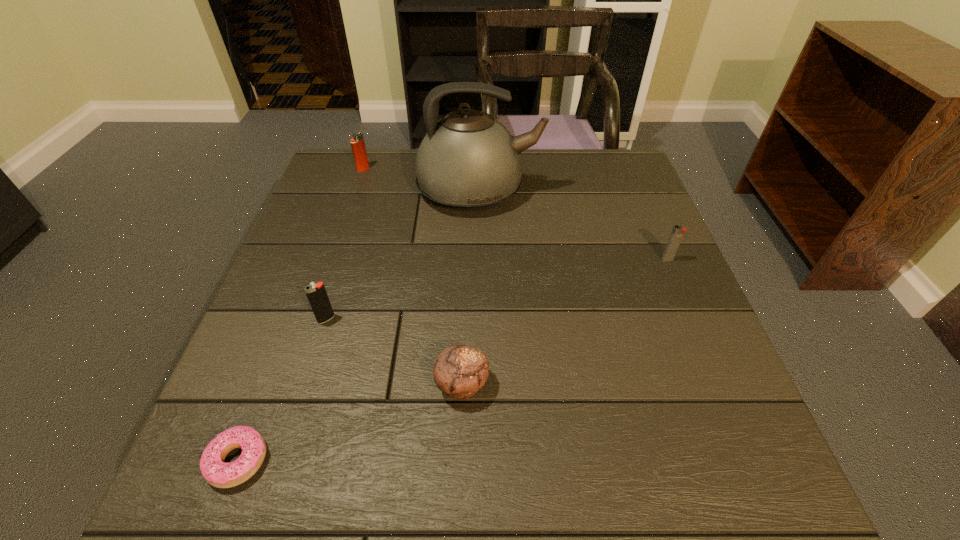
The height and width of the screenshot is (540, 960). I want to click on kettle, so click(x=468, y=161).

At what (x,y) coordinates should I click in order to perform the action: click on the farthest igniter. Please return your answer as a coordinate pair (x, y). The image size is (960, 540). Looking at the image, I should click on (357, 142).

At what (x,y) coordinates should I click in order to perform the action: click on the third nearest object. Please return your answer as a coordinate pair (x, y). The width and height of the screenshot is (960, 540). Looking at the image, I should click on (317, 296).

Find the location of `the rightmost object`. the rightmost object is located at coordinates (678, 231).

Identify the location of the rightmost igniter. (678, 231).

Find the location of a particular element. muffin is located at coordinates (460, 371).

The width and height of the screenshot is (960, 540). Identify the location of the shortest object. (216, 472).

The image size is (960, 540). I want to click on the nearest object, so click(216, 472).

Find the location of a particular element. vacant area located at the spout of the kettle is located at coordinates (566, 192).

Identify the location of vacant space located 0.080m on the front of the farthest igniter. (357, 187).